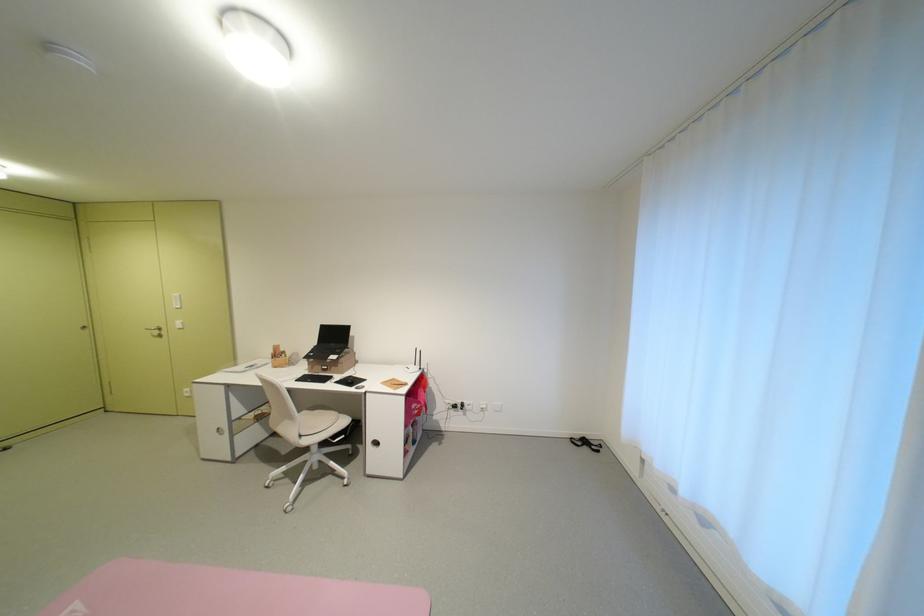
Locate an element on the screen. silver door handle is located at coordinates (154, 331).